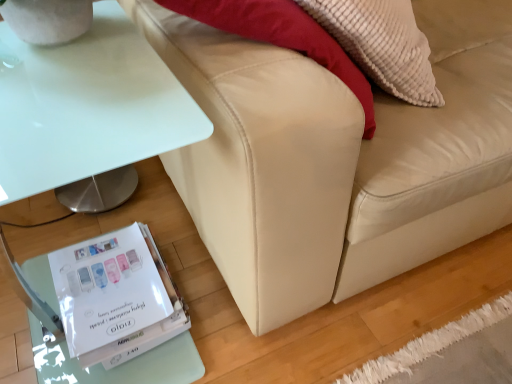
Question: In the image, is white glossy table at lower left positioned in front of or behind white glossy paperback book at lower left?

Choices:
 (A) front
 (B) behind

Answer: (A)

Question: Considering the positions of white glossy table at lower left and white glossy paperback book at lower left in the image, is white glossy table at lower left taller or shorter than white glossy paperback book at lower left?

Choices:
 (A) tall
 (B) short

Answer: (A)

Question: Which object is positioned farthest from the beige leather couch at lower right?

Choices:
 (A) white glossy paperback book at lower left
 (B) white glossy table at lower left

Answer: (A)

Question: Based on their relative distances, which object is farther from the white glossy table at lower left?

Choices:
 (A) beige leather couch at lower right
 (B) white glossy paperback book at lower left

Answer: (B)